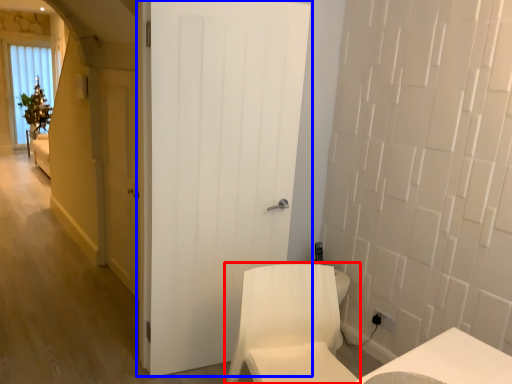
Question: Which object is further to the camera taking this photo, furniture (highlighted by a red box) or door (highlighted by a blue box)?

Choices:
 (A) furniture
 (B) door

Answer: (B)